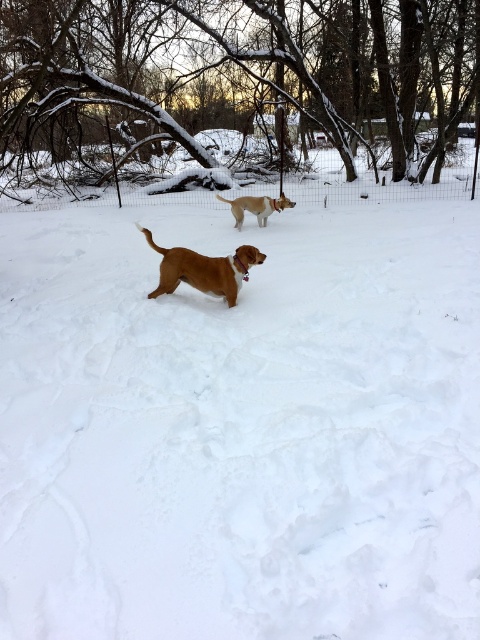
Question: Which of the following is the closest to the observer?

Choices:
 (A) (272, 202)
 (B) (218, 289)

Answer: (B)

Question: Is brown matte dog at center positioned at the back of brown fur dog at center?

Choices:
 (A) no
 (B) yes

Answer: (A)

Question: Can you confirm if brown matte dog at center is positioned to the left of brown fur dog at center?

Choices:
 (A) yes
 (B) no

Answer: (A)

Question: Is brown matte dog at center closer to camera compared to brown fur dog at center?

Choices:
 (A) no
 (B) yes

Answer: (B)

Question: Among these objects, which one is farthest from the camera?

Choices:
 (A) brown matte dog at center
 (B) brown fur dog at center

Answer: (B)